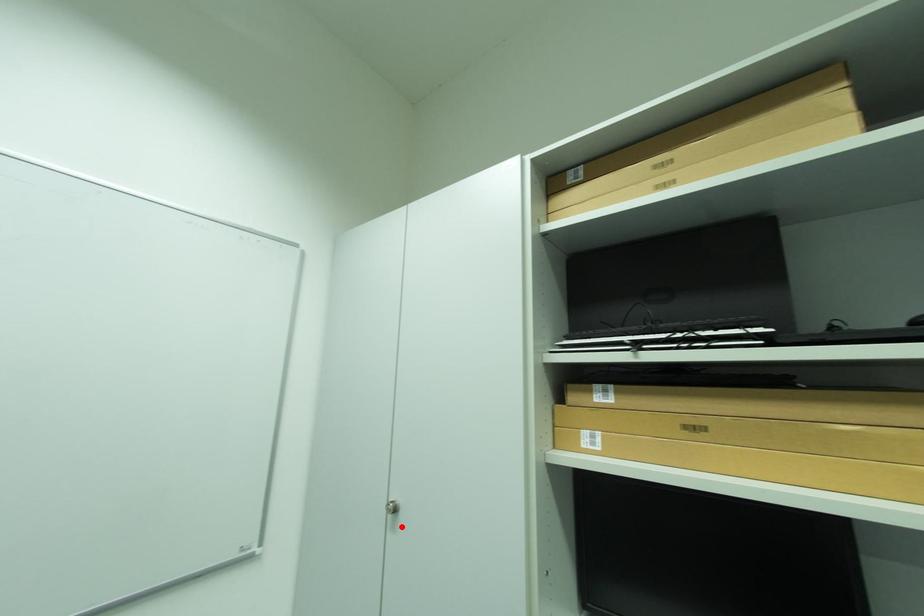
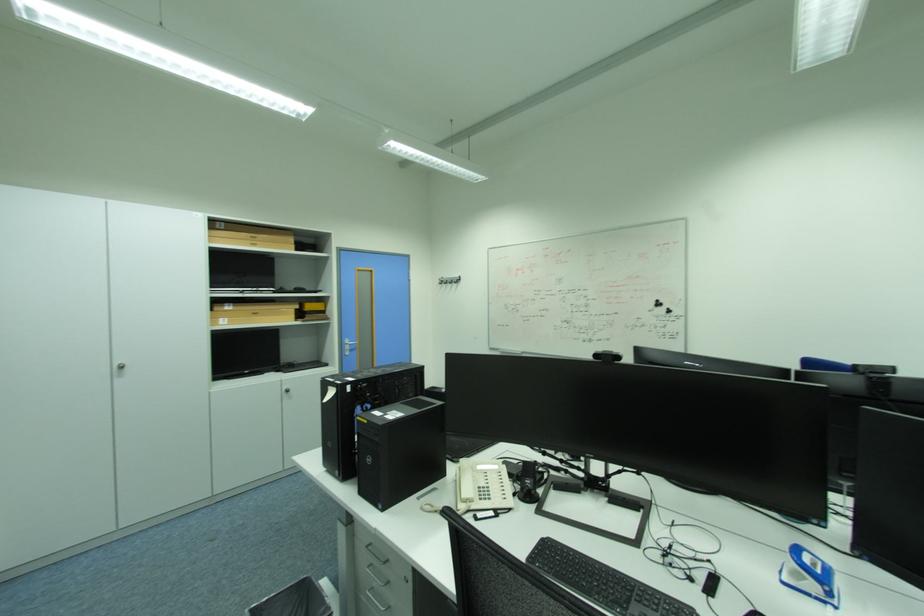
The point at the highlighted location is marked in the first image. Where is the corresponding point in the second image?

(128, 376)